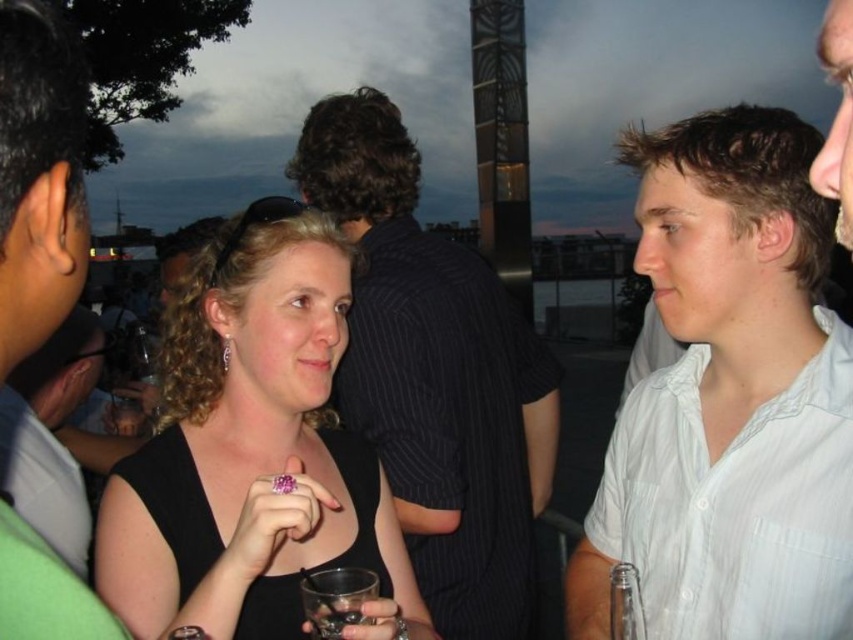
You are at a social gathering at dusk near a waterfront. You see a transparent glass at lower center. Where exactly is the transparent glass located in relation to the point marked at coordinates (335,598)?

The transparent glass at lower center is located exactly at the point marked by the coordinates (335,598).

Looking at this image, you are at a party and want to find someone wearing a black matte dress at center and a white striped shirt at right. Which one is taller?

The black matte dress at center is taller than the white striped shirt at right.